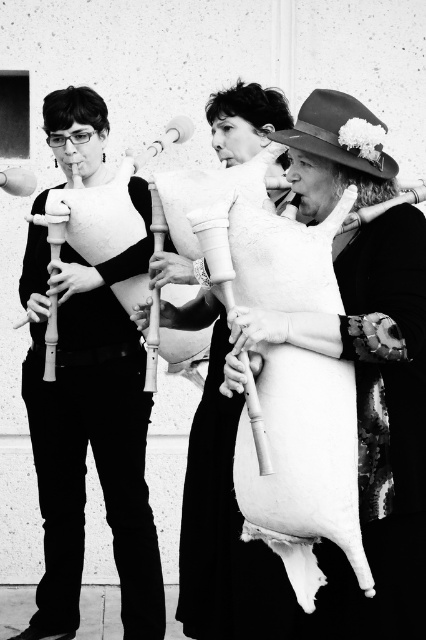
Question: Among these objects, which one is nearest to the camera?

Choices:
 (A) white matte bagpipe at center
 (B) matte white flute at left

Answer: (A)

Question: Which point is closer to the camera?

Choices:
 (A) (189, 444)
 (B) (92, 432)

Answer: (A)

Question: Can you confirm if matte white flute at left is positioned below white matte bagpipe at center?

Choices:
 (A) yes
 (B) no

Answer: (B)

Question: Is matte white flute at left further to the viewer compared to white matte bagpipe at center?

Choices:
 (A) yes
 (B) no

Answer: (A)

Question: Where is matte white flute at left located in relation to white matte bagpipe at center in the image?

Choices:
 (A) left
 (B) right

Answer: (A)

Question: Which point appears closest to the camera in this image?

Choices:
 (A) (141, 433)
 (B) (187, 529)

Answer: (B)